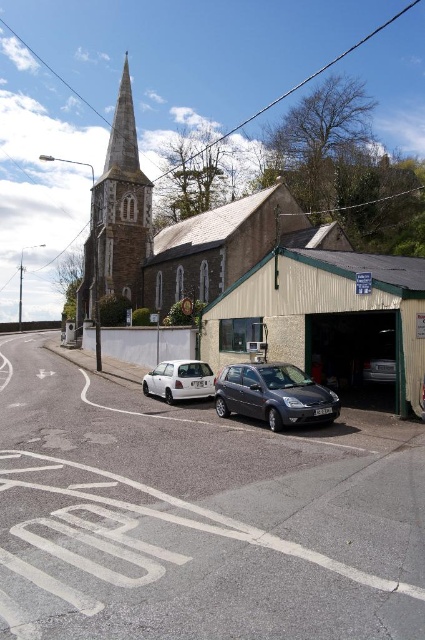
You are standing at the center of the street and see the church on the left and the garage at lower right. A point marked at coordinates (x=329, y=321) is part of which building? Please answer with either the church or the garage.

The point at coordinates (x=329, y=321) corresponds to the metallic and greenish garage at lower right.

You are a delivery person who needs to park your metallic silver car at center as close as possible to the smooth stone spire at upper left without blocking the garage door. What is the closest distance you can park the car to the spire?

The closest distance you can park the metallic silver car at center to the smooth stone spire at upper left is 117.55 feet, as that is the minimum distance between them.

You are standing at the center of the street looking towards the church. Which direction should you look to see the smooth stone spire at upper left?

You should look to the upper left to see the smooth stone spire at upper left as it is located at point (116,216).